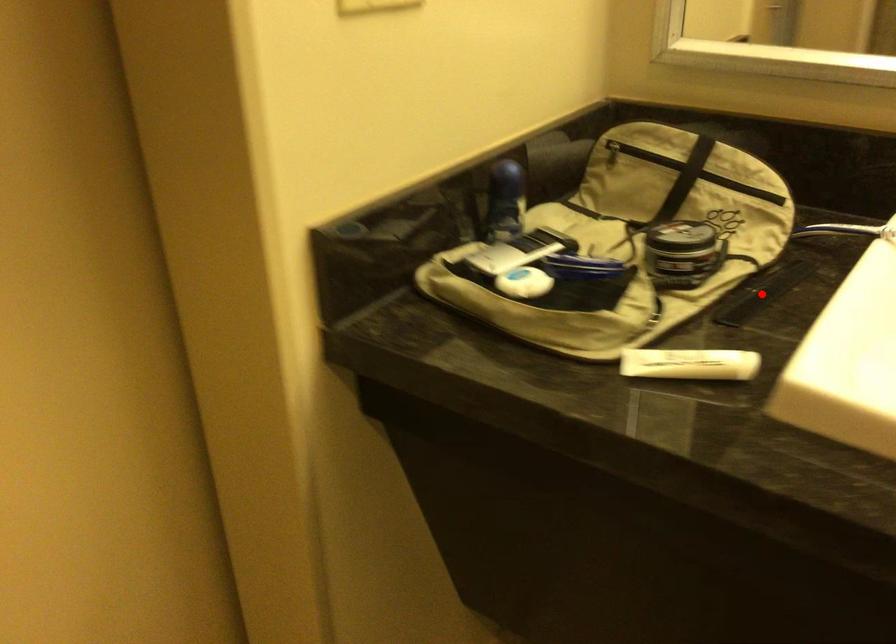
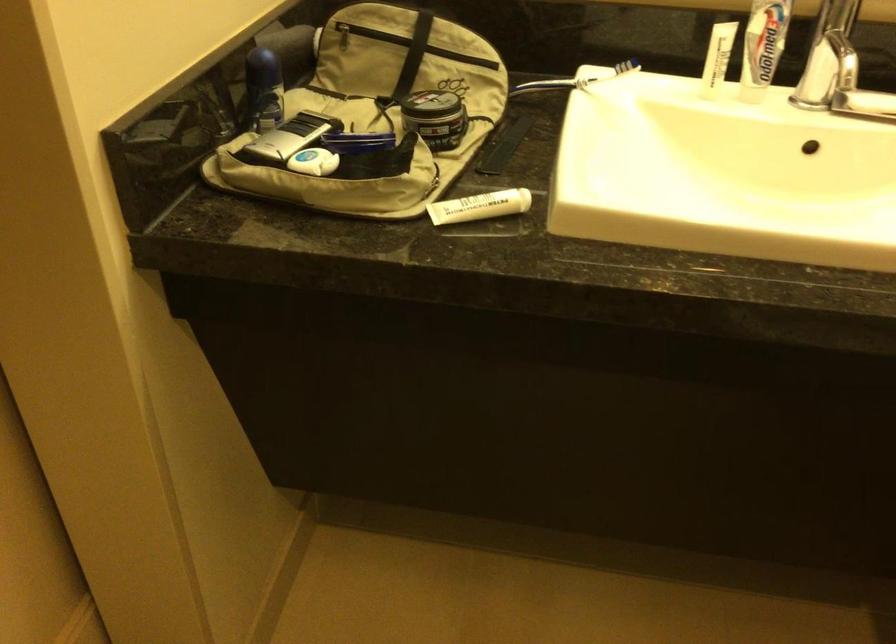
Locate, in the second image, the point that corresponds to the highlighted location in the first image.

(503, 146)